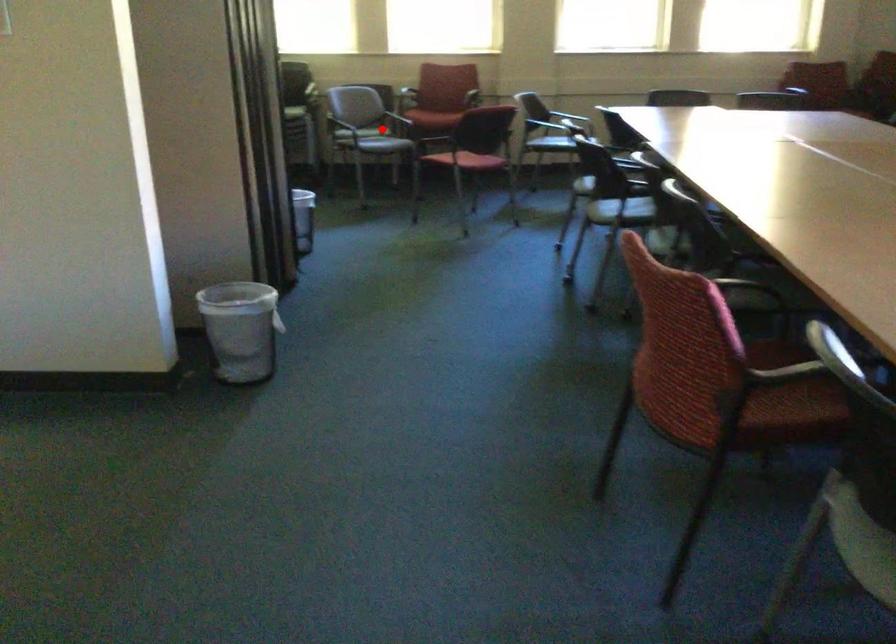
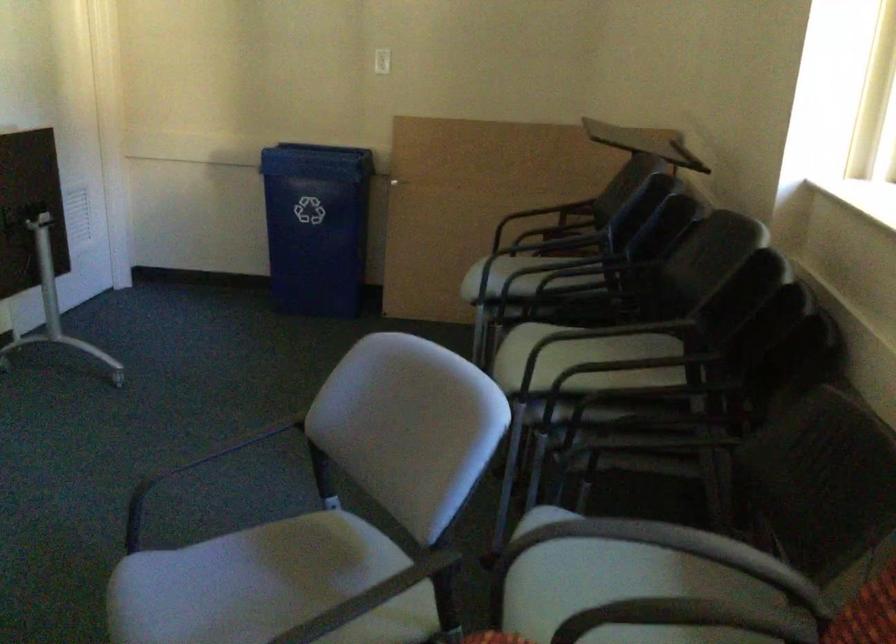
Question: A red point is marked in image1. In image2, is the corresponding 3D point closer to the camera or farther? Reply with the corresponding letter.

Choices:
 (A) The corresponding 3D point is closer.
 (B) The corresponding 3D point is farther.

Answer: (A)